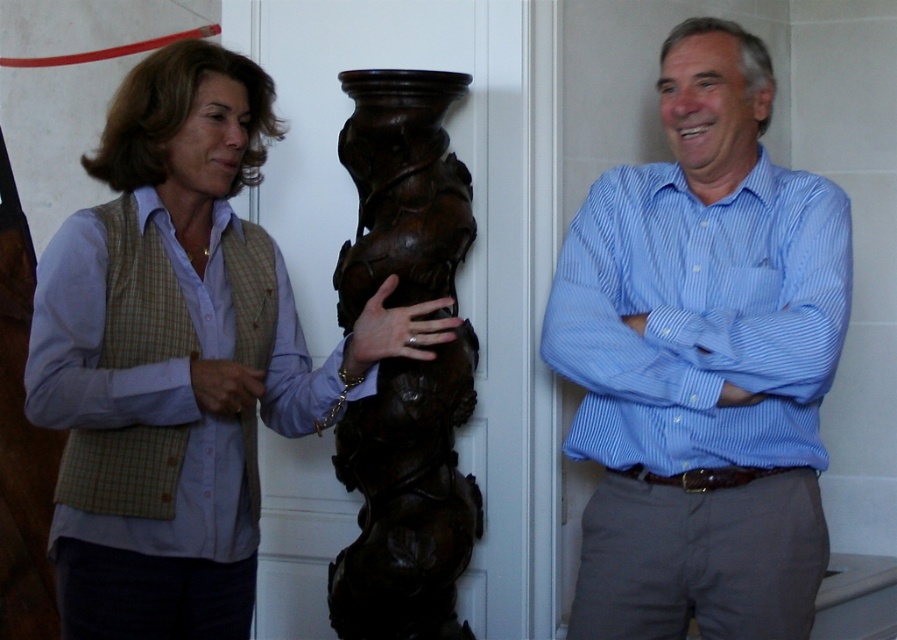
The height and width of the screenshot is (640, 897). What are the coordinates of `blue striped shirt at center` in the screenshot? It's located at (702, 362).

Where is `blue striped shirt at center`? This screenshot has height=640, width=897. blue striped shirt at center is located at coordinates (702, 362).

I want to click on blue striped shirt at center, so click(x=702, y=362).

Between brown polished wood column at center and light blue cotton shirt at left, which one appears on the right side from the viewer's perspective?

brown polished wood column at center

Is point (430, 484) positioned in front of point (50, 266)?

No, (430, 484) is behind (50, 266).

At what (x,y) coordinates should I click in order to perform the action: click on brown polished wood column at center. Please return your answer as a coordinate pair (x, y). This screenshot has height=640, width=897. Looking at the image, I should click on (407, 499).

Can you confirm if blue striped shirt at center is thinner than light blue cotton shirt at left?

Result: No.

Does blue striped shirt at center appear on the left side of light blue cotton shirt at left?

In fact, blue striped shirt at center is to the right of light blue cotton shirt at left.

The width and height of the screenshot is (897, 640). What do you see at coordinates (702, 362) in the screenshot? I see `blue striped shirt at center` at bounding box center [702, 362].

Identify the location of blue striped shirt at center. (702, 362).